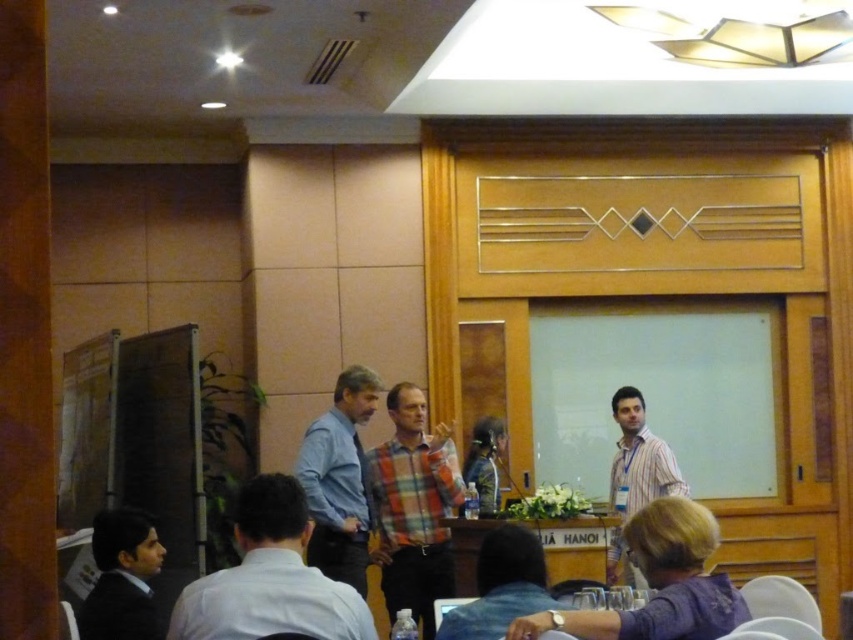
Question: Is white shirt at center further to camera compared to blue shirt at center?

Choices:
 (A) no
 (B) yes

Answer: (A)

Question: Can you confirm if dark blue suit at lower left is positioned to the right of denim shirt at lower center?

Choices:
 (A) yes
 (B) no

Answer: (B)

Question: Which object is positioned closest to the plaid fabric shirt at center?

Choices:
 (A) wooden at center
 (B) denim shirt at lower center

Answer: (A)

Question: Does blue shirt at center appear on the right side of wooden at center?

Choices:
 (A) yes
 (B) no

Answer: (B)

Question: Which point is closer to the camera?

Choices:
 (A) (509, 621)
 (B) (363, 554)

Answer: (A)

Question: Which object is positioned farthest from the striped cotton shirt at right?

Choices:
 (A) wooden at center
 (B) dark blue suit at lower left
 (C) blue shirt at center

Answer: (B)